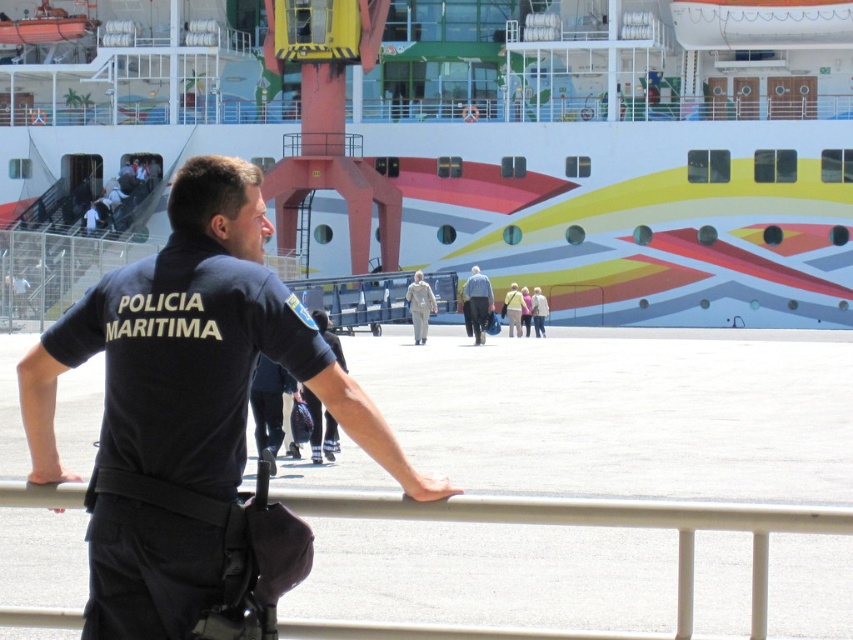
Which is more to the right, white matte statue at center or light beige fabric jacket at center?

Positioned to the right is light beige fabric jacket at center.

Is white matte statue at center to the right of light beige fabric jacket at center from the viewer's perspective?

No, white matte statue at center is not to the right of light beige fabric jacket at center.

Is point (422, 289) positioned in front of point (538, 289)?

That is True.

In order to click on white matte statue at center in this screenshot , I will do `click(421, 307)`.

Which is behind, point (480, 321) or point (424, 321)?

Point (480, 321)

Is point (468, 317) farther from camera compared to point (416, 316)?

Yes, point (468, 317) is behind point (416, 316).

Find the location of a particular element. light blue denim jeans at center is located at coordinates (477, 304).

Is black fabric uniform at center above white matte statue at center?

Incorrect, black fabric uniform at center is not positioned above white matte statue at center.

This screenshot has width=853, height=640. I want to click on black fabric uniform at center, so click(x=320, y=426).

Image resolution: width=853 pixels, height=640 pixels. What are the coordinates of `black fabric uniform at center` in the screenshot? It's located at (320, 426).